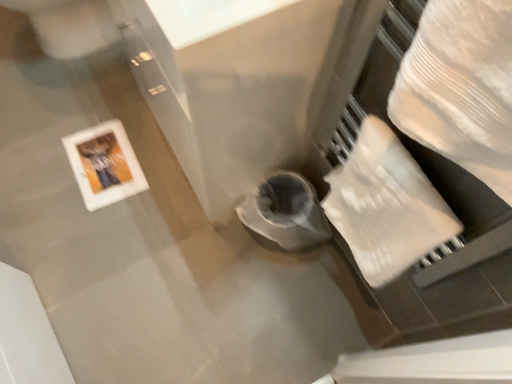
You are a GUI agent. You are given a task and a screenshot of the screen. Output one action in this format:
    pyautogui.click(x=<x>, y=<y>)
    Task: Click on the spots to the right of white glossy picture frame at upper left
    
    Given the screenshot: What is the action you would take?
    pos(157,178)